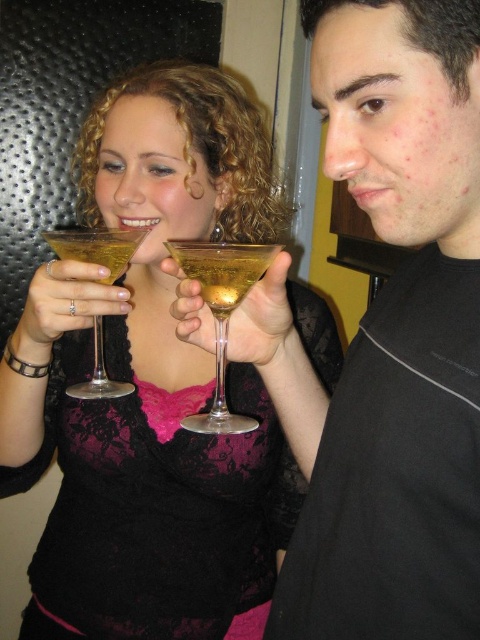
Question: Which of the following is the closest to the observer?

Choices:
 (A) (196, 424)
 (B) (455, 518)

Answer: (B)

Question: From the image, what is the correct spatial relationship of clear glass martini glasses at center in relation to transparent glass at center?

Choices:
 (A) right
 (B) left

Answer: (B)

Question: Based on their relative distances, which object is nearer to the clear glass martini glass at left?

Choices:
 (A) clear glass martini glasses at center
 (B) transparent glass at center
 (C) matte black shirt at right

Answer: (B)

Question: Does transparent glass at center appear under translucent glass martini at center?

Choices:
 (A) no
 (B) yes

Answer: (B)

Question: Can you confirm if matte black shirt at right is positioned above transparent glass at center?

Choices:
 (A) no
 (B) yes

Answer: (A)

Question: Estimate the real-world distances between objects in this image. Which object is farther from the clear glass martini glass at left?

Choices:
 (A) translucent glass martini at center
 (B) clear glass martini glasses at center
 (C) transparent glass at center
 (D) matte black shirt at right

Answer: (D)